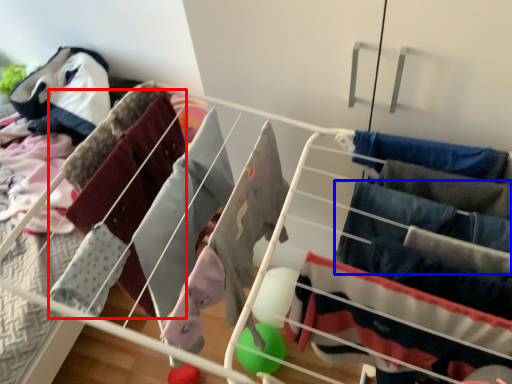
Question: Among these objects, which one is nearest to the camera, clothing (highlighted by a red box) or clothing (highlighted by a blue box)?

Choices:
 (A) clothing
 (B) clothing

Answer: (B)